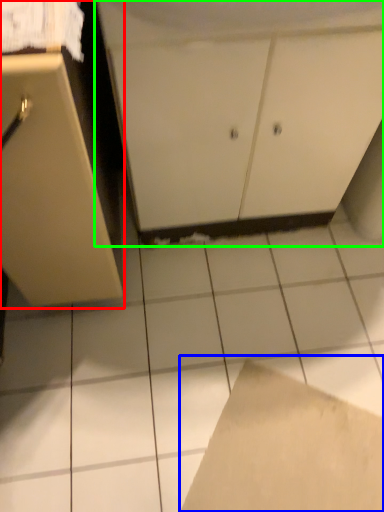
Question: Which object is the farthest from cabinetry (highlighted by a red box)? Choose among these: cardboard (highlighted by a blue box) or cabinetry (highlighted by a green box).

Choices:
 (A) cardboard
 (B) cabinetry

Answer: (A)